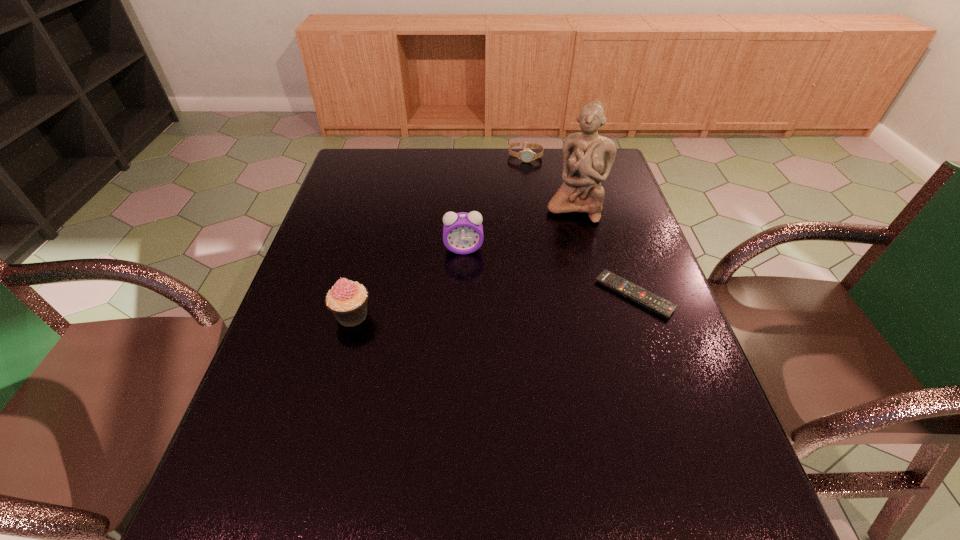
Locate an element on the screen. The width and height of the screenshot is (960, 540). vacant space situated on the face of the second object from left to right is located at coordinates (467, 359).

Locate an element on the screen. vacant region located 0.260m on the face of the second object from left to right is located at coordinates (467, 333).

The width and height of the screenshot is (960, 540). Find the location of `blank area located on the face of the second object from left to right`. blank area located on the face of the second object from left to right is located at coordinates (465, 276).

At what (x,y) coordinates should I click in order to perform the action: click on free space located on the face of the watch. Please return your answer as a coordinate pair (x, y). This screenshot has width=960, height=540. Looking at the image, I should click on (511, 227).

Where is `vacant space situated on the face of the watch`? The width and height of the screenshot is (960, 540). vacant space situated on the face of the watch is located at coordinates (520, 179).

The height and width of the screenshot is (540, 960). I want to click on vacant area located on the face of the watch, so click(515, 208).

At what (x,y) coordinates should I click in order to perform the action: click on blank space located on the front-facing side of the second farthest object. Please return your answer as a coordinate pair (x, y). This screenshot has height=540, width=960. Looking at the image, I should click on (544, 284).

Locate an element on the screen. vacant area located on the front-facing side of the second farthest object is located at coordinates (538, 301).

This screenshot has width=960, height=540. I want to click on vacant space located on the front-facing side of the second farthest object, so click(535, 309).

Where is `object at the far edge`? object at the far edge is located at coordinates (526, 155).